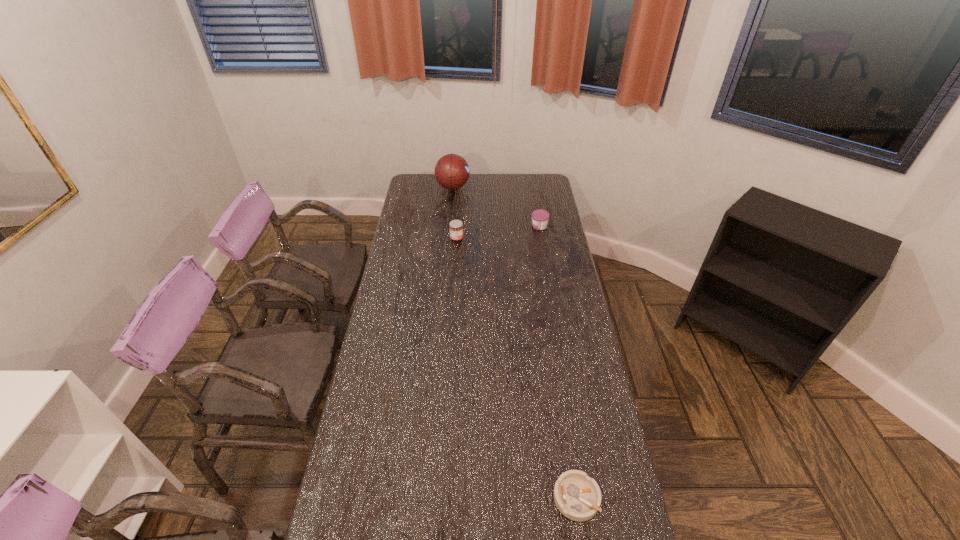
You are a GUI agent. You are given a task and a screenshot of the screen. Output one action in this format:
    pyautogui.click(x=<x>, y=<y>)
    Task: Click on the free spot at the right edge of the desktop
    This screenshot has height=540, width=960.
    Given the screenshot: What is the action you would take?
    pyautogui.click(x=608, y=457)

The image size is (960, 540). I want to click on free space at the far left corner of the desktop, so click(x=412, y=190).

Identify the location of vacant region at the far right corner of the desktop. (541, 180).

Where is `empty location between the nearer jam and the third tallest object`? Image resolution: width=960 pixels, height=540 pixels. empty location between the nearer jam and the third tallest object is located at coordinates (498, 233).

Image resolution: width=960 pixels, height=540 pixels. I want to click on free spot between the farthest object and the third farthest object, so click(455, 213).

The image size is (960, 540). I want to click on unoccupied area between the third farthest object and the farthest object, so click(x=455, y=213).

Image resolution: width=960 pixels, height=540 pixels. In order to click on vacant area that lies between the shortest object and the third tallest object in this screenshot , I will do `click(558, 362)`.

Image resolution: width=960 pixels, height=540 pixels. I want to click on free point between the farthest object and the nearest object, so click(x=515, y=342).

This screenshot has height=540, width=960. Identify the location of free space between the shortest object and the right jam. (558, 362).

Locate an element on the screen. object that is the second closest to the basketball is located at coordinates (540, 217).